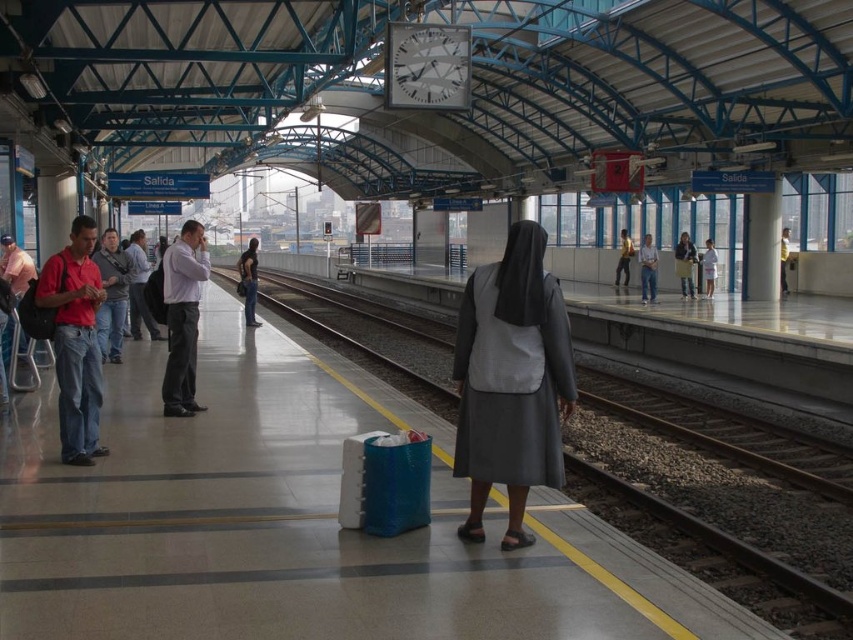
Is smooth metal train track at center thinner than jeans at center?

Incorrect, smooth metal train track at center's width is not less than jeans at center's.

Between smooth metal train track at center and jeans at center, which one is positioned lower?

smooth metal train track at center is lower down.

Locate an element on the screen. This screenshot has width=853, height=640. smooth metal train track at center is located at coordinates (718, 520).

Is smooth metal train track at center to the left of gray matte nun's habit at center from the viewer's perspective?

Correct, you'll find smooth metal train track at center to the left of gray matte nun's habit at center.

Which of these two, smooth metal train track at center or gray matte nun's habit at center, stands shorter?

With less height is gray matte nun's habit at center.

Which is in front, point (375, 317) or point (514, 525)?

Point (514, 525) is in front.

The height and width of the screenshot is (640, 853). I want to click on smooth metal train track at center, so click(718, 520).

Is point (762, 604) closer to camera compared to point (445, 26)?

Yes, it is.

Looking at this image, is smooth metal train track at center wider than metallic silver clock at upper center?

Yes.

Image resolution: width=853 pixels, height=640 pixels. I want to click on smooth metal train track at center, so click(718, 520).